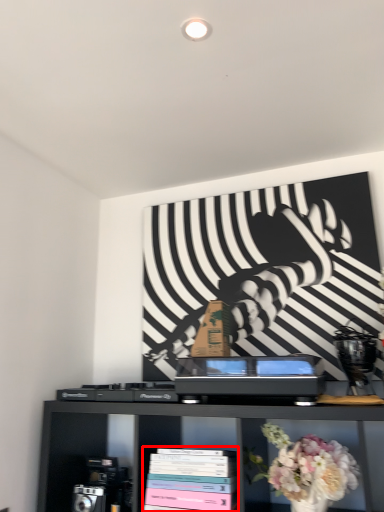
Question: Where is book (annotated by the red box) located in relation to flower in the image?

Choices:
 (A) right
 (B) left

Answer: (B)